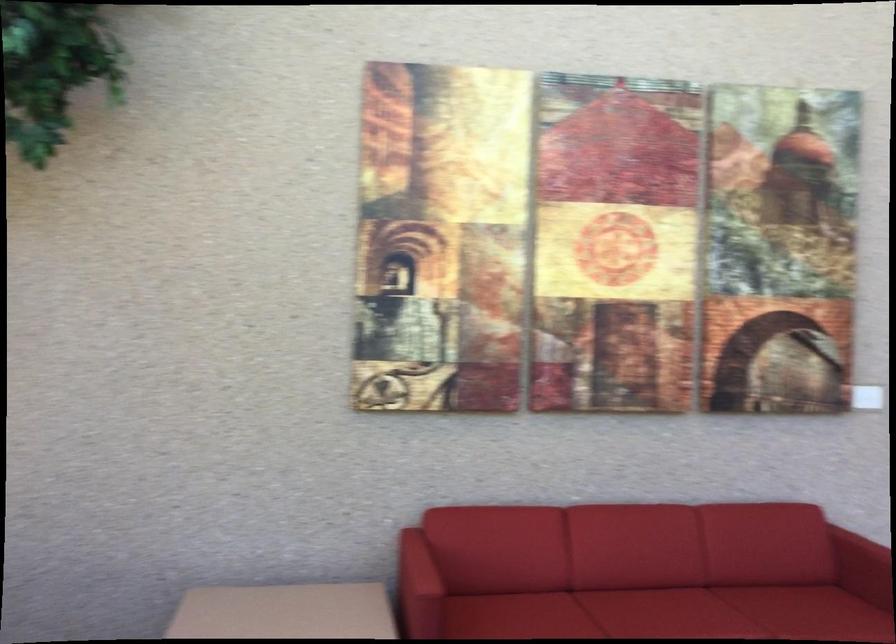
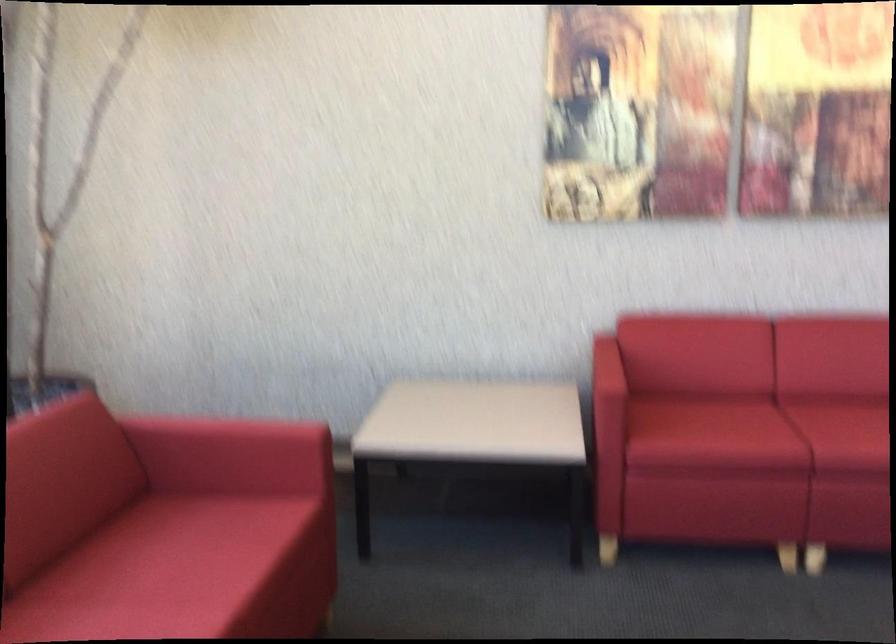
Question: Based on the continuous images, in which direction is the camera rotating? Reply with the corresponding letter.

Choices:
 (A) Left
 (B) Right
 (C) Up
 (D) Down

Answer: (A)